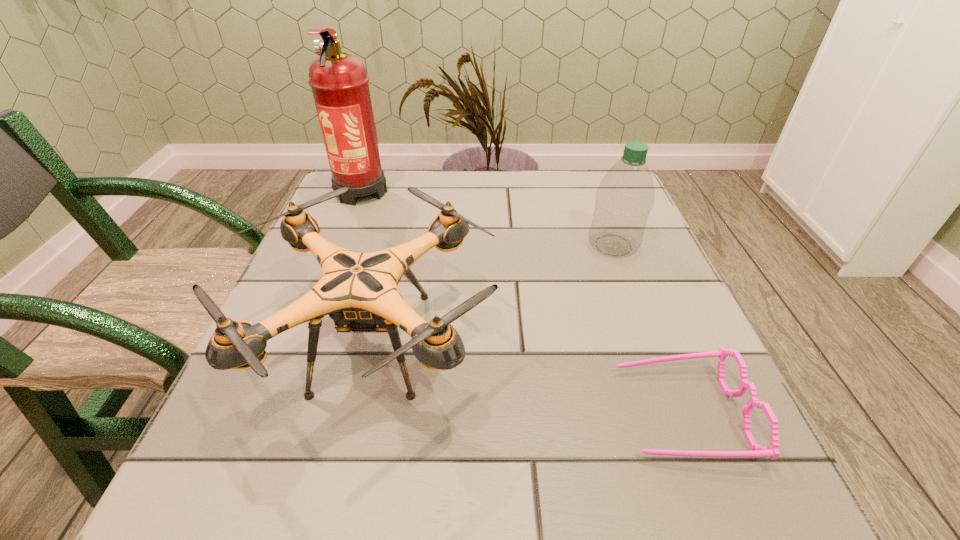
Image resolution: width=960 pixels, height=540 pixels. In order to click on vacant area situated on the arms of the shortest object in this screenshot , I will do `click(405, 413)`.

Where is `object that is at the far edge`? The width and height of the screenshot is (960, 540). object that is at the far edge is located at coordinates (339, 82).

This screenshot has height=540, width=960. In order to click on drone that is at the near edge in this screenshot , I will do `click(358, 290)`.

At what (x,y) coordinates should I click in order to perform the action: click on spectacles that is at the near edge. Please return your answer as a coordinate pair (x, y). Looking at the image, I should click on tap(771, 451).

Where is `fire extinguisher that is at the left edge`? The height and width of the screenshot is (540, 960). fire extinguisher that is at the left edge is located at coordinates (339, 82).

Find the location of a particular element. The image size is (960, 540). drone that is at the left edge is located at coordinates (358, 290).

Identify the location of water bottle that is at the right edge. (625, 196).

Identify the location of spectacles that is at the right edge. (771, 451).

Where is `object positioned at the far left corner`? The width and height of the screenshot is (960, 540). object positioned at the far left corner is located at coordinates (339, 82).

In order to click on object at the near left corner in this screenshot , I will do `click(358, 290)`.